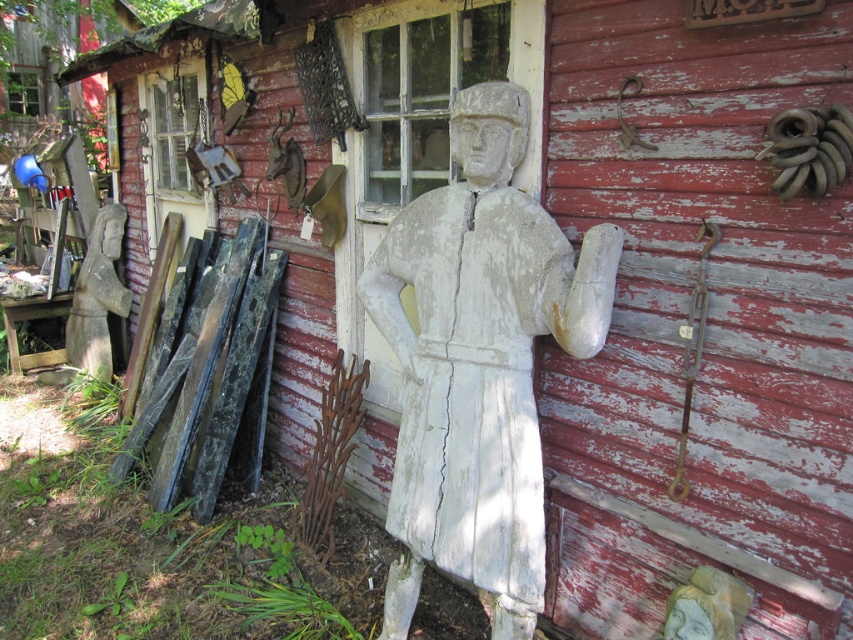
Question: Can you confirm if white weathered wood statue at center is wider than gray stone statue at left?

Choices:
 (A) yes
 (B) no

Answer: (A)

Question: Can you confirm if white weathered wood statue at center is positioned below gray stone statue at left?

Choices:
 (A) yes
 (B) no

Answer: (A)

Question: Can you confirm if white weathered wood statue at center is thinner than gray stone statue at left?

Choices:
 (A) yes
 (B) no

Answer: (B)

Question: Which point appears farthest from the camera in this image?

Choices:
 (A) (527, 515)
 (B) (68, 378)

Answer: (B)